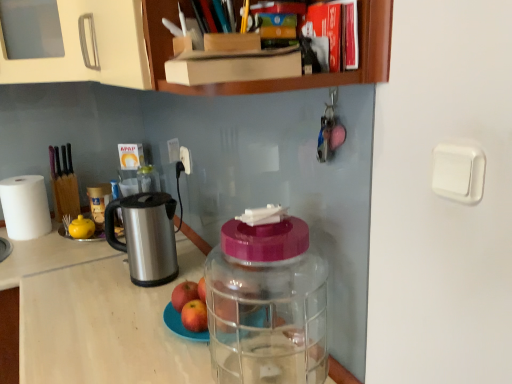
Question: Is white plastic power outlet at upper center smaller than red matte apple at center, which is the second apple in front-to-back order?

Choices:
 (A) yes
 (B) no

Answer: (A)

Question: From the image's perspective, would you say white plastic power outlet at upper center is positioned over red matte apple at center, which is the second apple in front-to-back order?

Choices:
 (A) yes
 (B) no

Answer: (A)

Question: Is white plastic power outlet at upper center thinner than red matte apple at center, which is the second apple in front-to-back order?

Choices:
 (A) yes
 (B) no

Answer: (A)

Question: Can you confirm if white plastic power outlet at upper center is taller than red matte apple at center, the first apple viewed from the back?

Choices:
 (A) no
 (B) yes

Answer: (B)

Question: Considering the relative sizes of white plastic power outlet at upper center and red matte apple at center, the first apple viewed from the back, in the image provided, is white plastic power outlet at upper center wider than red matte apple at center, the first apple viewed from the back,?

Choices:
 (A) yes
 (B) no

Answer: (B)

Question: Is white plastic power outlet at upper center bigger than red matte apple at center, the first apple viewed from the back?

Choices:
 (A) yes
 (B) no

Answer: (B)

Question: From the image's perspective, is white plastic power outlet at upper center below transparent plastic container at center?

Choices:
 (A) no
 (B) yes

Answer: (A)

Question: Is white plastic power outlet at upper center shorter than transparent plastic container at center?

Choices:
 (A) no
 (B) yes

Answer: (B)

Question: Is the depth of white plastic power outlet at upper center less than that of transparent plastic container at center?

Choices:
 (A) yes
 (B) no

Answer: (B)

Question: Is white plastic power outlet at upper center facing away from transparent plastic container at center?

Choices:
 (A) yes
 (B) no

Answer: (B)

Question: Is white plastic power outlet at upper center smaller than transparent plastic container at center?

Choices:
 (A) no
 (B) yes

Answer: (B)

Question: Does white plastic power outlet at upper center touch transparent plastic container at center?

Choices:
 (A) yes
 (B) no

Answer: (B)

Question: From a real-world perspective, is red matte apple at center, the second apple from the back, over red matte apple at center, which is the second apple in front-to-back order?

Choices:
 (A) yes
 (B) no

Answer: (B)